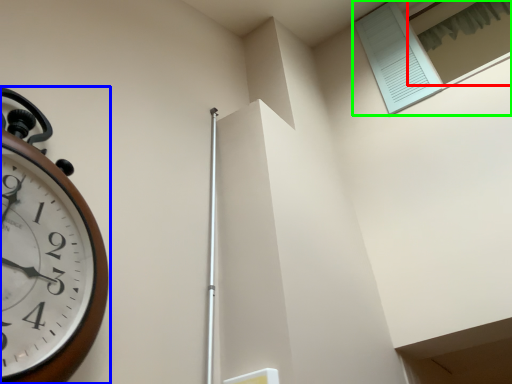
Question: Based on their relative distances, which object is farther from window (highlighted by a red box)? Choose from wall clock (highlighted by a blue box) and window (highlighted by a green box).

Choices:
 (A) wall clock
 (B) window

Answer: (A)